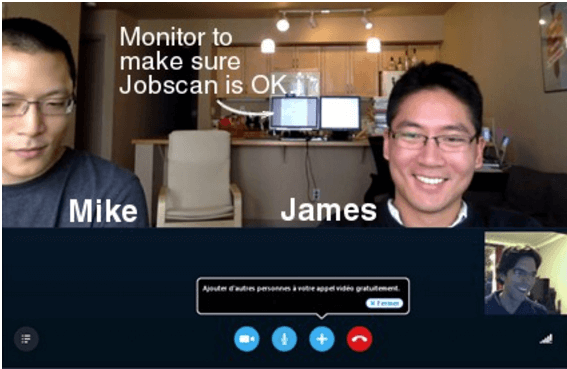
The image size is (567, 369). I want to click on chair, so click(189, 180).